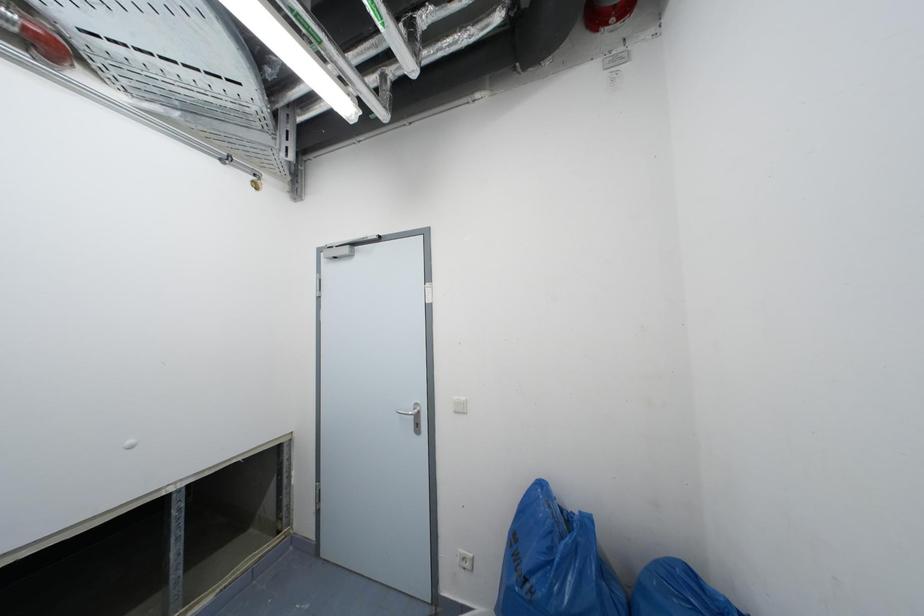
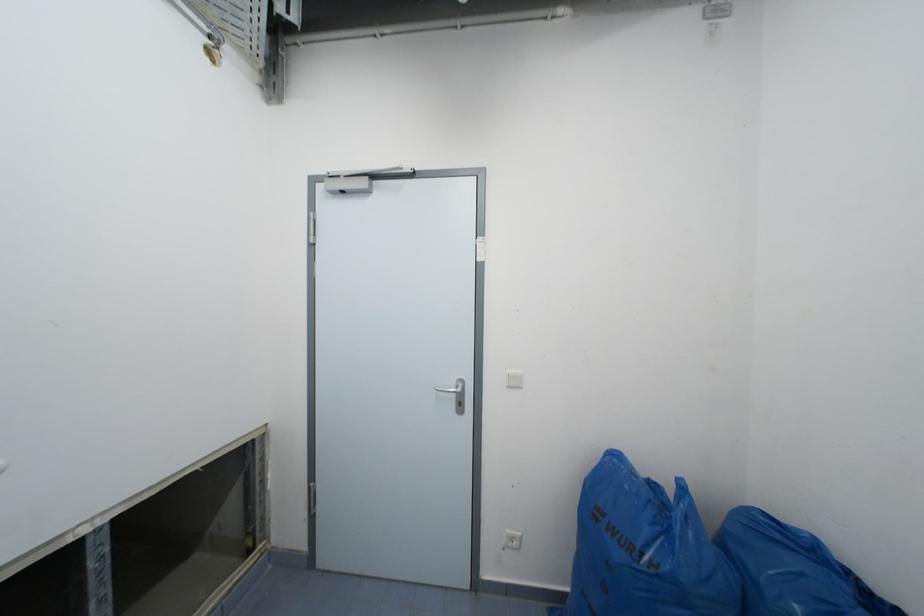
Question: The images are taken continuously from a first-person perspective. In which direction is your viewpoint rotating?

Choices:
 (A) Left
 (B) Right
 (C) Up
 (D) Down

Answer: (B)